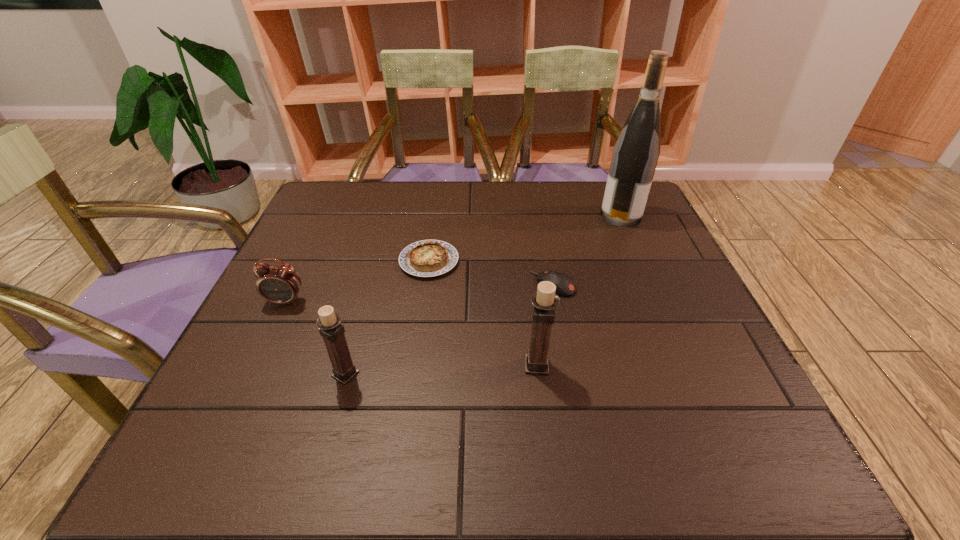
What are the coordinates of `the leftmost object` in the screenshot? It's located at (280, 284).

Locate an element on the screen. vacant region located on the back of the left candle holder is located at coordinates (364, 308).

In order to click on vacant area located 0.260m on the right of the taller candle holder in this screenshot , I will do `click(686, 365)`.

Where is `free region located on the back of the shortest object`? This screenshot has height=540, width=960. free region located on the back of the shortest object is located at coordinates (437, 202).

At what (x,y) coordinates should I click in order to perform the action: click on free location located on the left of the tallest object. Please return your answer as a coordinate pair (x, y). This screenshot has height=540, width=960. Looking at the image, I should click on (562, 215).

Where is `free space located on the right of the computer mouse`? The width and height of the screenshot is (960, 540). free space located on the right of the computer mouse is located at coordinates [x=601, y=284].

Identify the location of free space located 0.060m on the face of the fourth tallest object. (273, 328).

In order to click on object that is at the far edge in this screenshot , I will do `click(636, 152)`.

Locate an element on the screen. The width and height of the screenshot is (960, 540). object located in the left edge section of the desktop is located at coordinates (280, 284).

Where is `object at the right edge`? The image size is (960, 540). object at the right edge is located at coordinates (636, 152).